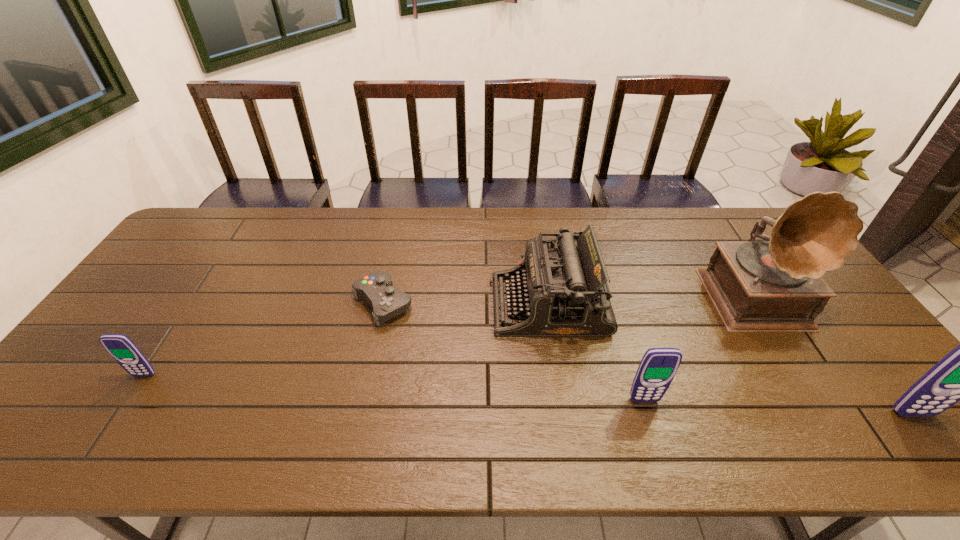
This screenshot has height=540, width=960. Find the location of `free space located 0.070m on the front-facing side of the leftmost cellular telephone`. free space located 0.070m on the front-facing side of the leftmost cellular telephone is located at coordinates (126, 402).

Where is `vacant space situated 0.200m on the keyboard of the typewriter`? This screenshot has width=960, height=540. vacant space situated 0.200m on the keyboard of the typewriter is located at coordinates (421, 305).

You are a GUI agent. You are given a task and a screenshot of the screen. Output one action in this format:
    pyautogui.click(x=<x>, y=<y>)
    Task: Click on the vacant space situated on the keyboard of the typewriter
    Image resolution: width=960 pixels, height=540 pixels.
    Given the screenshot: What is the action you would take?
    pyautogui.click(x=463, y=305)

This screenshot has height=540, width=960. Identify the location of vacant space located 0.230m on the keyboard of the typewriter. (411, 305).

The width and height of the screenshot is (960, 540). Identify the location of free spot located 0.300m on the left of the second object from left to right. (249, 303).

Where is `vacant region located from the horn of the record player`? The width and height of the screenshot is (960, 540). vacant region located from the horn of the record player is located at coordinates (804, 362).

I want to click on object at the left edge, so click(x=120, y=347).

The height and width of the screenshot is (540, 960). Find the location of `cellular telephone present at the right edge`. cellular telephone present at the right edge is located at coordinates (959, 376).

Where is `record player situated at the right edge`? This screenshot has height=540, width=960. record player situated at the right edge is located at coordinates (777, 286).

At what (x,y) coordinates should I click in order to perform the action: click on object at the near right corner. Please return your answer as a coordinate pair (x, y). This screenshot has height=540, width=960. Looking at the image, I should click on (959, 376).